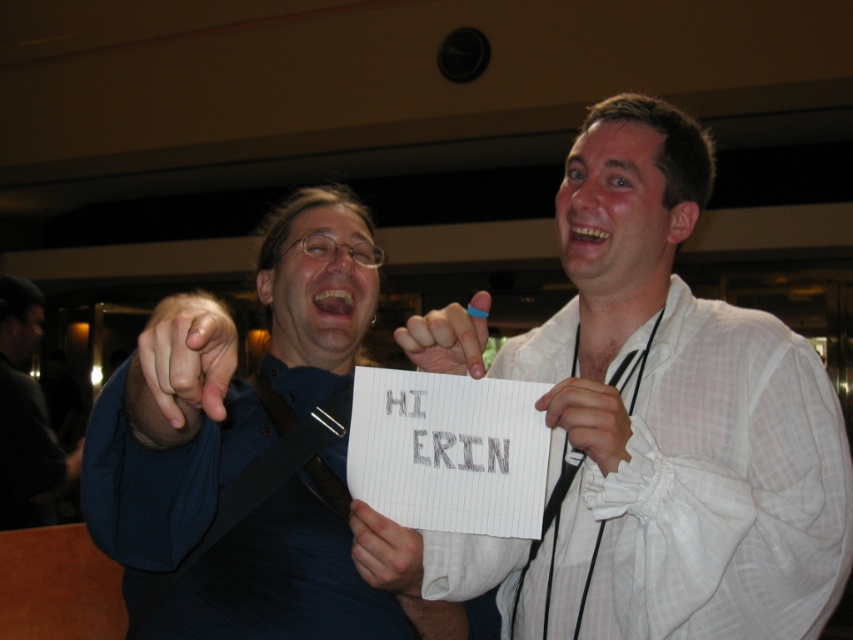
Can you confirm if matte black hand at center is smaller than white fabric at center?

No.

Is point (210, 358) farther from viewer compared to point (595, 456)?

No.

The image size is (853, 640). I want to click on matte black hand at center, so click(x=181, y=368).

At what (x,y) coordinates should I click in order to perform the action: click on matte black hand at center. Please return your answer as a coordinate pair (x, y). The height and width of the screenshot is (640, 853). Looking at the image, I should click on (181, 368).

Does white checkered shirt at upper right have a lesser height compared to blue shirt at left?

No.

Looking at this image, can you confirm if white checkered shirt at upper right is thinner than blue shirt at left?

In fact, white checkered shirt at upper right might be wider than blue shirt at left.

Does point (595, 252) come farther from viewer compared to point (264, 259)?

No, it is not.

Locate an element on the screen. white checkered shirt at upper right is located at coordinates (665, 428).

Which of these two, white checkered shirt at upper right or white fabric at center, stands shorter?

white fabric at center

Is the position of white checkered shirt at upper right less distant than that of white fabric at center?

No, it is not.

Image resolution: width=853 pixels, height=640 pixels. What are the coordinates of `white checkered shirt at upper right` in the screenshot? It's located at (665, 428).

Where is `white checkered shirt at upper right`? white checkered shirt at upper right is located at coordinates 665,428.